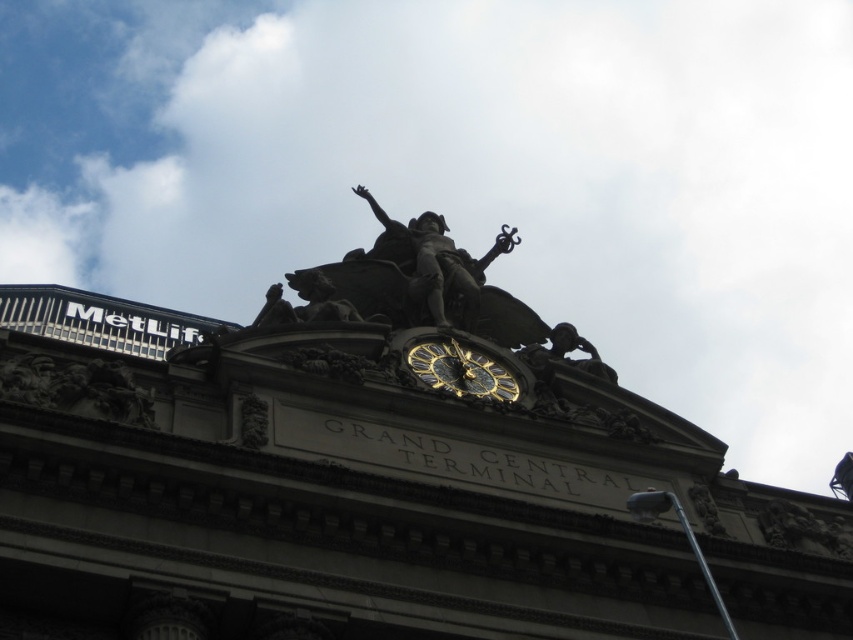
Who is shorter, bronze statue at center or gold polished clock at center?

Standing shorter between the two is gold polished clock at center.

What do you see at coordinates (439, 262) in the screenshot? The width and height of the screenshot is (853, 640). I see `bronze statue at center` at bounding box center [439, 262].

I want to click on bronze statue at center, so click(439, 262).

Image resolution: width=853 pixels, height=640 pixels. In order to click on bronze statue at center in this screenshot , I will do `click(439, 262)`.